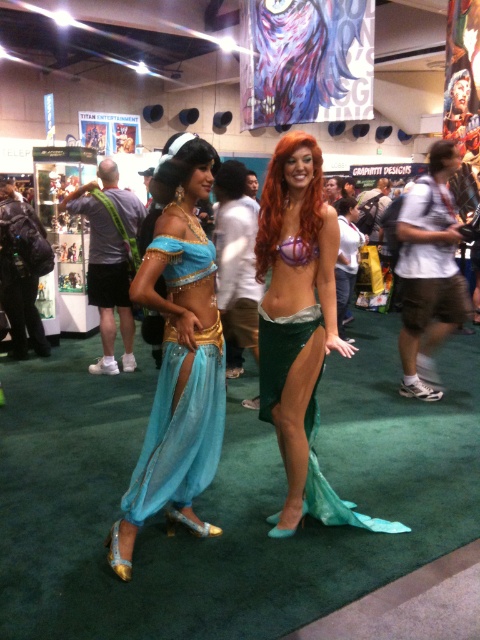
Looking at this image, you are an event organizer checking the layout of the convention hall. You notice the matte blue fabric dress at center and the shiny green tail at center. Which object takes up more space in the image?

The shiny green tail at center takes up more space in the image because it is larger than the matte blue fabric dress at center.

You are a photographer at the event and want to capture both the matte blue fabric dress at center and the shiny green tail at center in a single shot. Which object should you focus on first to ensure both are in frame?

The matte blue fabric dress at center is taller than the shiny green tail at center, so focus on the taller object first to ensure both fit within the frame.